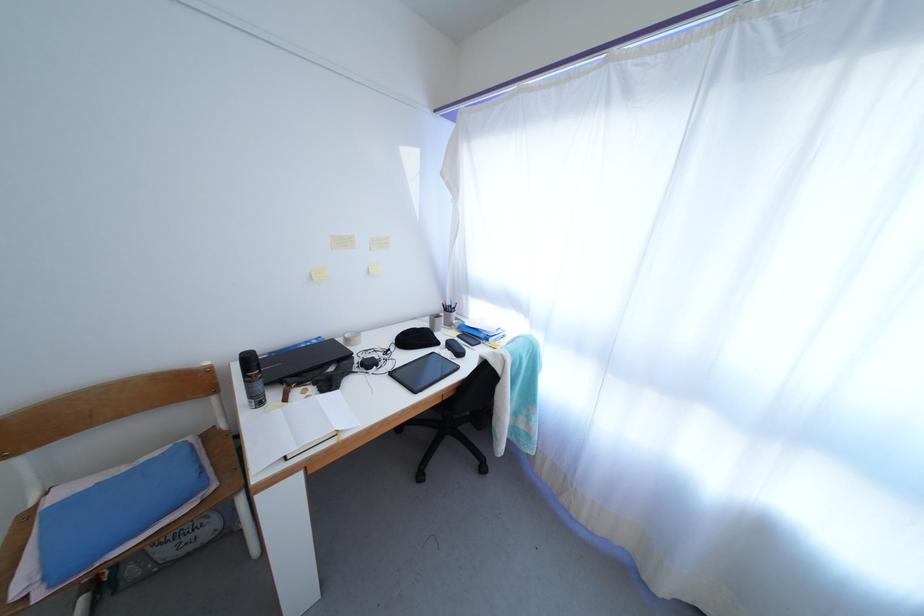
Identify the location of wooden chair sitting surface. Image resolution: width=924 pixels, height=616 pixels. pyautogui.click(x=116, y=509).